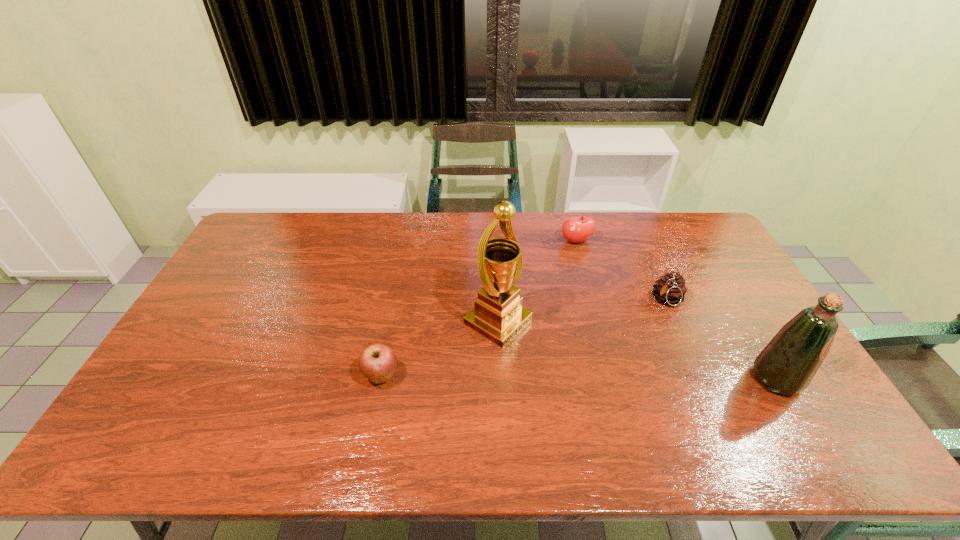
At what (x,y) coordinates should I click in order to perform the action: click on apple that is at the near edge. Please return your answer as a coordinate pair (x, y). The width and height of the screenshot is (960, 540). Looking at the image, I should click on (377, 362).

Locate an element on the screen. olive oil located at the near edge is located at coordinates (787, 365).

What are the coordinates of `object located in the right edge section of the desktop` in the screenshot? It's located at (787, 365).

Locate an element on the screen. This screenshot has height=540, width=960. object positioned at the near right corner is located at coordinates (787, 365).

Image resolution: width=960 pixels, height=540 pixels. Identify the location of vacant space at the far edge of the desktop. (423, 251).

At what (x,y) coordinates should I click in order to perform the action: click on vacant region at the near edge of the desktop. Please return your answer as a coordinate pair (x, y). The image size is (960, 540). Looking at the image, I should click on (480, 392).

The width and height of the screenshot is (960, 540). Identify the location of vacant region at the left edge. (232, 296).

In the image, there is a desktop. Where is `blank space at the right edge`? The image size is (960, 540). blank space at the right edge is located at coordinates [754, 323].

In the image, there is a desktop. Where is `vacant space at the far left corner`? The width and height of the screenshot is (960, 540). vacant space at the far left corner is located at coordinates (281, 225).

Locate an element on the screen. The height and width of the screenshot is (540, 960). unoccupied area between the third object from left to right and the award is located at coordinates (537, 282).